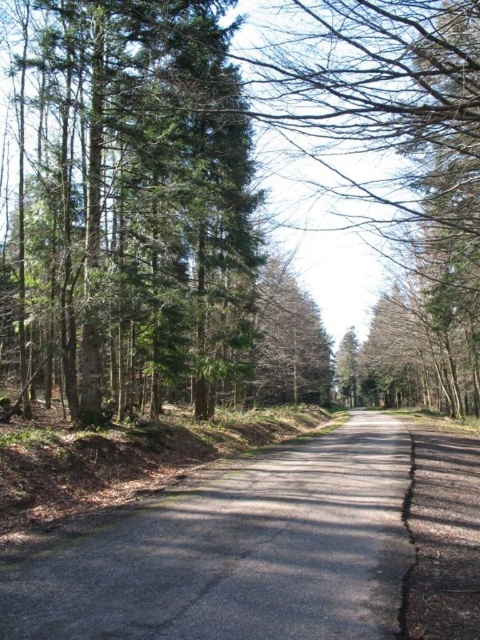
You are standing at the center of the paved road in the forest. You see a point labeled as point (140, 173). What object does this point correspond to?

The point (140, 173) corresponds to the green matte tree at left.

You are a hiker standing on the smooth asphalt road at center. Looking towards the green matte tree at left, can you determine if the tree is taller than the road?

The green matte tree at left is taller than the smooth asphalt road at center, so yes, the tree is taller than the road.